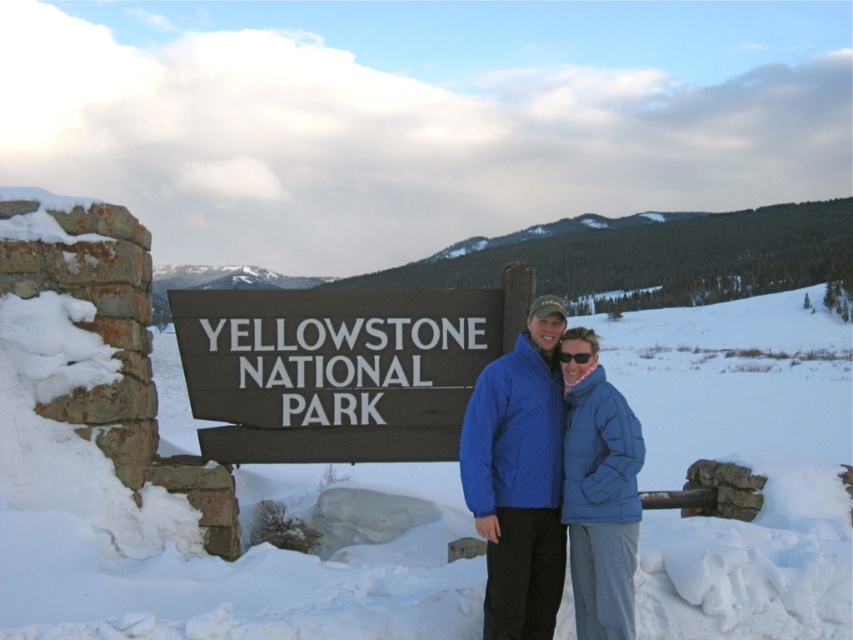
You are a photographer trying to capture the two people in the scene. The two blue puffy jackets at center and blue puffy jacket at center are part of your focus. Which one is positioned to the left?

The blue puffy jackets at center is positioned to the left of the blue puffy jacket at center.

You are a photographer trying to capture a clear shot of the brown wooden sign at center without any obstructions. The blue puffy jacket at center is currently in your frame. What should you do to ensure the sign is visible?

The blue puffy jacket at center is behind the brown wooden sign at center, so moving the photographer or adjusting the angle to focus on the front of the sign would allow the brown wooden sign at center to be visible without obstruction.